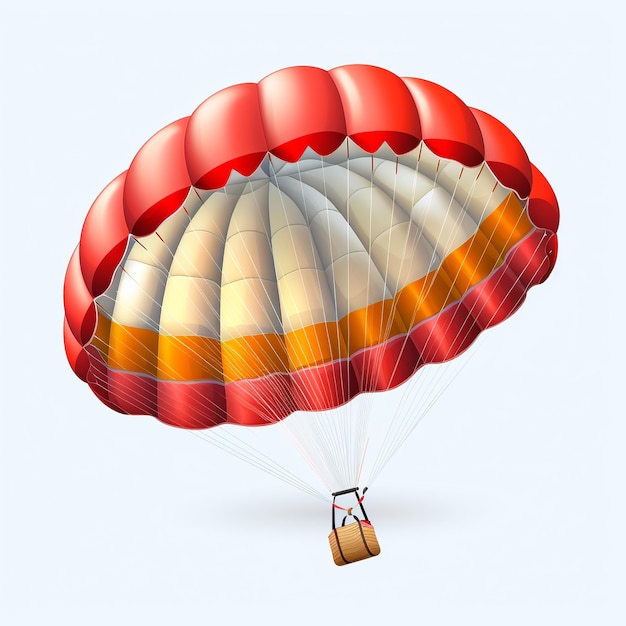
Find the location of a particular element. cable is located at coordinates (372, 393).